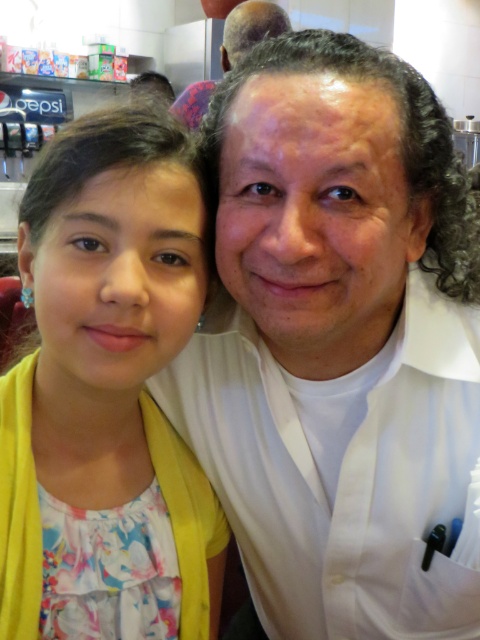
In the scene, there are two people, a father and daughter. The daughter is on the left wearing a yellow cardigan over a floral dress, and the father is on the right in a white shirt with a pen clipped to the pocket. There is a point marked at coordinates (337, 339). What object is located at that point?

The point at (337, 339) indicates the white smooth shirt at center.